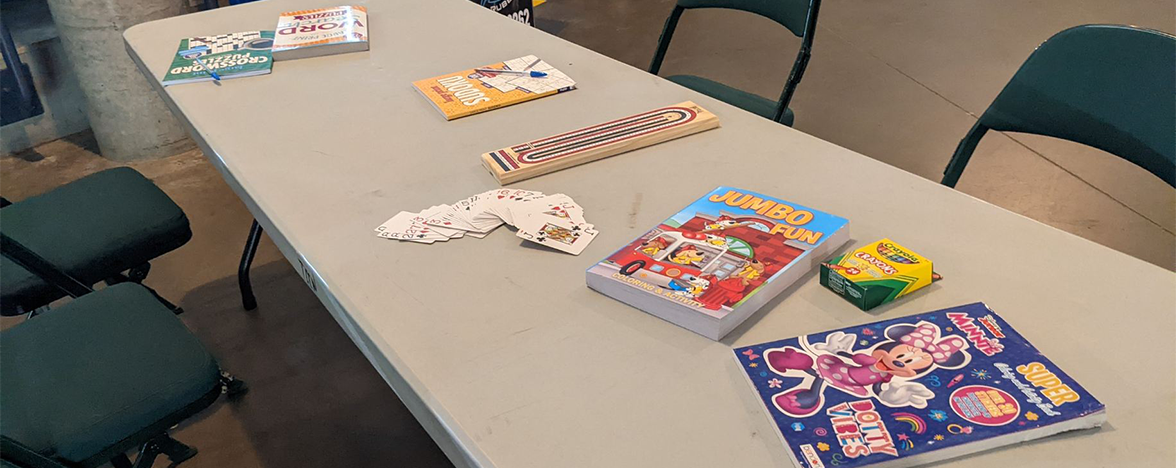
This screenshot has height=468, width=1176. In order to click on crayon box in this screenshot , I will do `click(874, 272)`.